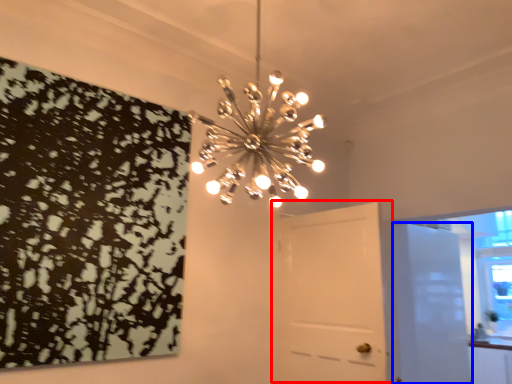
Question: Which of the following is the farthest to the observer, door (highlighted by a red box) or door (highlighted by a blue box)?

Choices:
 (A) door
 (B) door

Answer: (B)